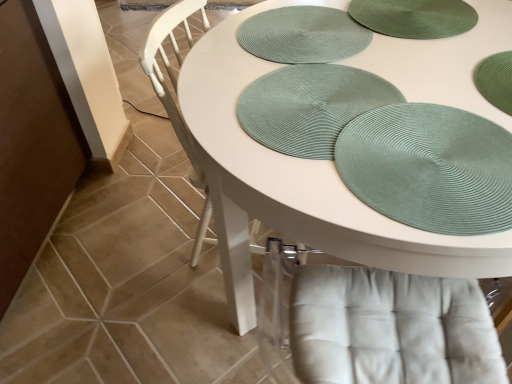
Identify the location of vacant space situated on the left part of white textured chair at center. This screenshot has height=384, width=512. (135, 243).